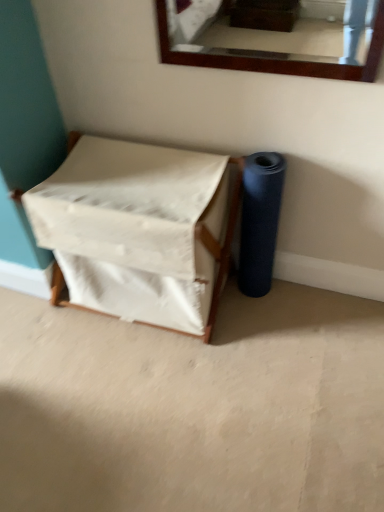
Question: Considering the relative sizes of white fabric-covered box at center-left and blue matte yoga mat at right in the image provided, is white fabric-covered box at center-left thinner than blue matte yoga mat at right?

Choices:
 (A) yes
 (B) no

Answer: (B)

Question: Is the surface of white fabric-covered box at center-left in direct contact with blue matte yoga mat at right?

Choices:
 (A) no
 (B) yes

Answer: (A)

Question: Is the position of white fabric-covered box at center-left less distant than that of blue matte yoga mat at right?

Choices:
 (A) yes
 (B) no

Answer: (A)

Question: Does white fabric-covered box at center-left have a lesser height compared to blue matte yoga mat at right?

Choices:
 (A) no
 (B) yes

Answer: (B)

Question: Does white fabric-covered box at center-left have a larger size compared to blue matte yoga mat at right?

Choices:
 (A) no
 (B) yes

Answer: (B)

Question: From a real-world perspective, is white fabric-covered box at center-left located higher than blue matte yoga mat at right?

Choices:
 (A) yes
 (B) no

Answer: (B)

Question: Is blue matte yoga mat at right facing away from white fabric-covered box at center-left?

Choices:
 (A) yes
 (B) no

Answer: (B)

Question: Is white fabric-covered box at center-left inside blue matte yoga mat at right?

Choices:
 (A) no
 (B) yes

Answer: (A)

Question: Does blue matte yoga mat at right have a smaller size compared to white fabric-covered box at center-left?

Choices:
 (A) no
 (B) yes

Answer: (B)

Question: Is blue matte yoga mat at right thinner than white fabric-covered box at center-left?

Choices:
 (A) no
 (B) yes

Answer: (B)

Question: From the image's perspective, is blue matte yoga mat at right on top of white fabric-covered box at center-left?

Choices:
 (A) yes
 (B) no

Answer: (A)

Question: Is blue matte yoga mat at right far from white fabric-covered box at center-left?

Choices:
 (A) yes
 (B) no

Answer: (B)

Question: From the image's perspective, is white fabric-covered box at center-left positioned above or below blue matte yoga mat at right?

Choices:
 (A) above
 (B) below

Answer: (B)